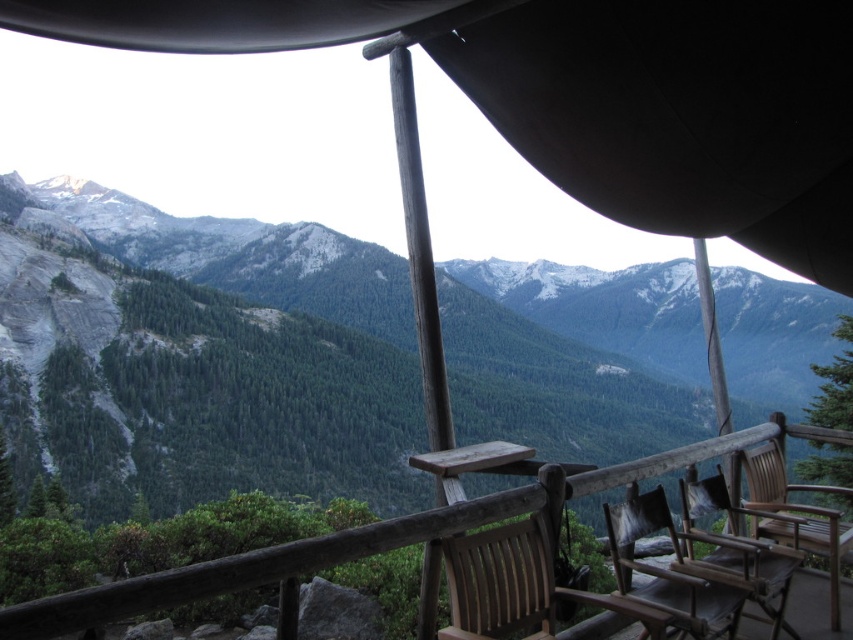
You are standing on a deck overlooking mountains and want to sit down. Where is the wooden textured chair at center located in terms of its 2D coordinates?

The wooden textured chair at center is located at the 2D coordinates of point (668, 570).

You are a delivery person with a box that is 2 meters long. You need to place the box between the wooden textured chair at center and the wooden chair at lower right. Can the box fit in the space between them?

The distance between the wooden textured chair at center and the wooden chair at lower right is 3.11 meters. Since the box is 2 meters long, it can fit in the space between them as there is enough room.